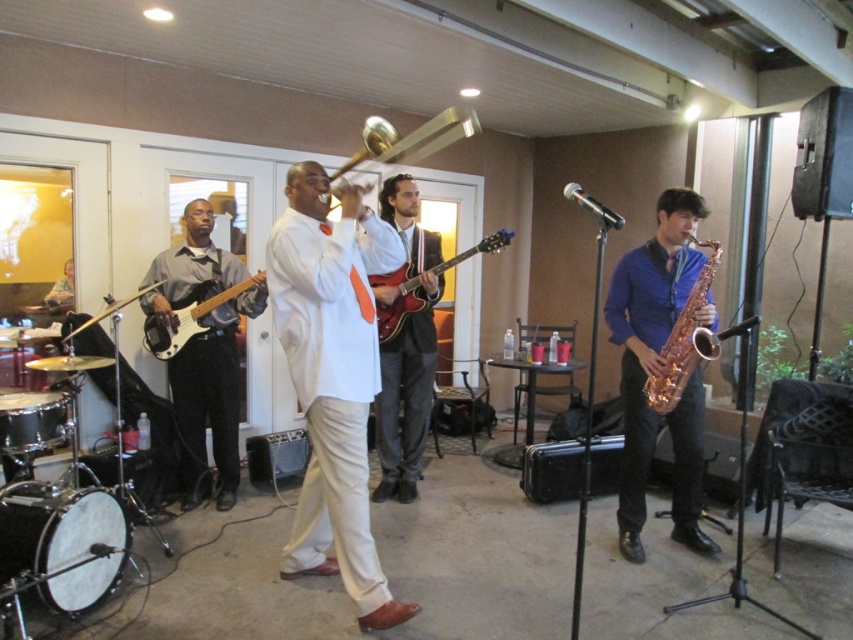
Which of these two, rose gold saxophone at right or white drumhead at lower left, stands taller?

rose gold saxophone at right

Who is more distant from viewer, (698, 513) or (73, 582)?

Point (698, 513)

I want to click on rose gold saxophone at right, so click(x=659, y=371).

Can you confirm if shiny red guitar at center is smaller than shiny red electric guitar at center?

Actually, shiny red guitar at center might be larger than shiny red electric guitar at center.

Is shiny red guitar at center bigger than shiny red electric guitar at center?

Correct, shiny red guitar at center is larger in size than shiny red electric guitar at center.

Is point (395, 285) farther from viewer compared to point (434, 300)?

Yes, point (395, 285) is behind point (434, 300).

I want to click on shiny red guitar at center, so click(x=407, y=352).

Is white satin suit at center positioned before white drumhead at lower left?

Yes, it is.

Who is more distant from viewer, (343,337) or (26,515)?

The point (26,515) is behind.

Measure the distance between white satin suit at center and camera.

white satin suit at center and camera are 2.60 meters apart from each other.

I want to click on white satin suit at center, so click(334, 378).